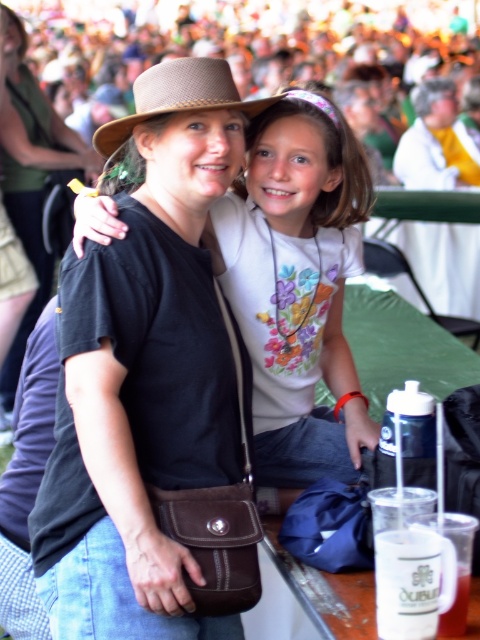
Where is the matte brown hat at center located in the image?

The matte brown hat at center is located at point (x=298, y=285).

You are a photographer at the event and want to ensure both the matte black shirt at center and the brown woven cowboy hat at center are clearly visible in your photo. Since the camera can only focus on one object at a time, which object should you focus on to ensure the other remains in the background?

The matte black shirt at center is located above the brown woven cowboy hat at center. Therefore, focusing on the matte black shirt at center would place the brown woven cowboy hat at center in the background, ensuring both are visible.

Looking at the scene, where is the matte black shirt at center in relation to the brown woven cowboy hat at center?

The matte black shirt at center is to the left of the brown woven cowboy hat at center.